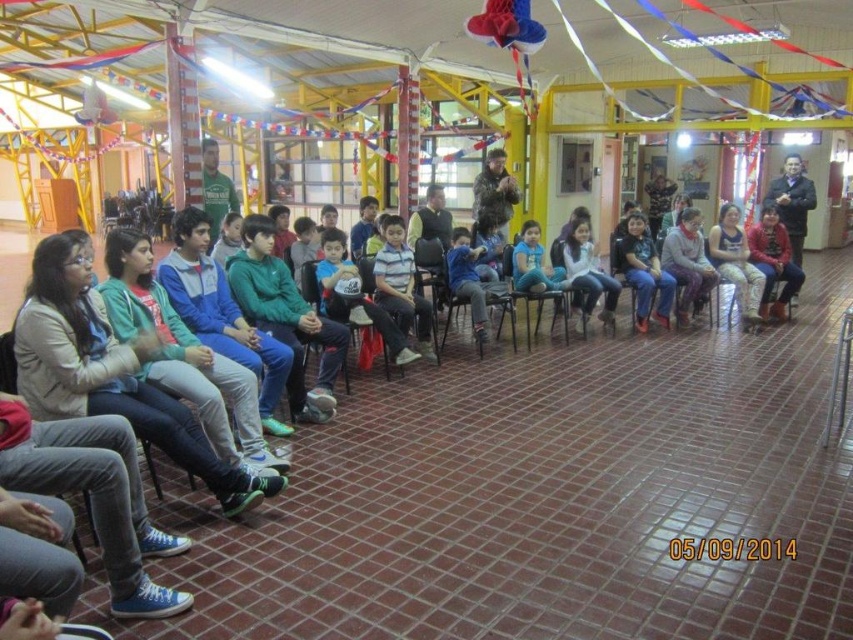
Question: Which of the following is the farthest from the observer?

Choices:
 (A) (659, 320)
 (B) (518, 284)

Answer: (A)

Question: Is light gray sweater at center to the right of red sweater at center from the viewer's perspective?

Choices:
 (A) yes
 (B) no

Answer: (B)

Question: Can you confirm if black plastic chair at center is smaller than green fabric shirt at upper center?

Choices:
 (A) no
 (B) yes

Answer: (A)

Question: Does light gray sweater at center have a smaller size compared to green fabric shirt at upper center?

Choices:
 (A) yes
 (B) no

Answer: (A)

Question: Estimate the real-world distances between objects in this image. Which object is closer to the green fabric shirt at upper center?

Choices:
 (A) red sweater at center
 (B) fuzzy brown jacket at upper center
 (C) black plastic chair at center

Answer: (B)

Question: Estimate the real-world distances between objects in this image. Which object is closer to the fuzzy brown jacket at upper center?

Choices:
 (A) blue denim jeans at center
 (B) matte black shirt at center

Answer: (A)